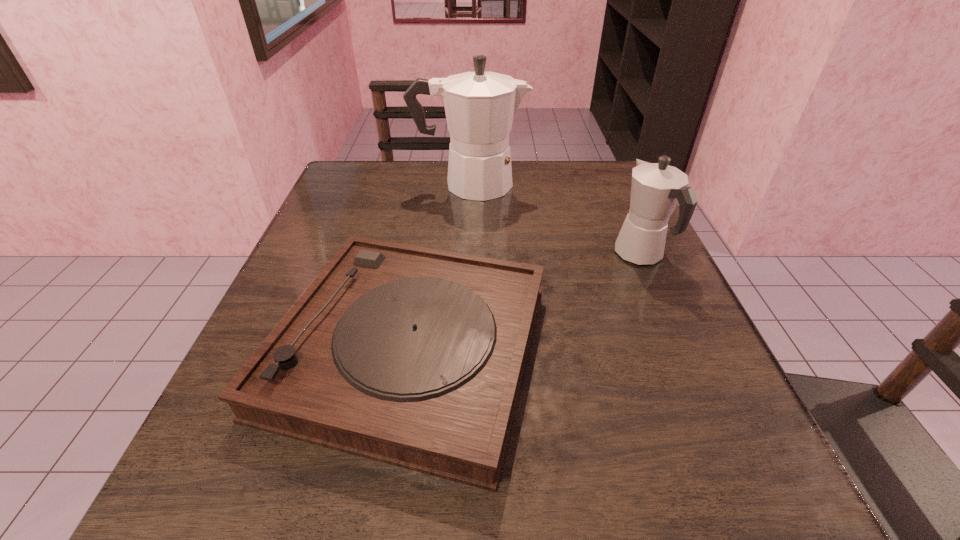
I want to click on object that is at the left edge, so click(411, 356).

I want to click on object positioned at the right edge, so click(656, 189).

The width and height of the screenshot is (960, 540). Identify the location of object that is at the near left corner. (411, 356).

Where is `vacant region at the near edge`? vacant region at the near edge is located at coordinates (612, 521).

You are a GUI agent. You are given a task and a screenshot of the screen. Output one action in this format:
    pyautogui.click(x=<x>, y=<y>)
    Task: Click on the vacant space at the left edge of the desktop
    Image resolution: width=960 pixels, height=540 pixels.
    Given the screenshot: What is the action you would take?
    pyautogui.click(x=350, y=218)

This screenshot has height=540, width=960. I want to click on vacant region at the right edge, so click(675, 382).

Where is `vacant region at the far left corner of the desktop`? vacant region at the far left corner of the desktop is located at coordinates (357, 171).

In the image, there is a desktop. At what (x,y) coordinates should I click in order to perform the action: click on vacant space at the near left corner. Please return your answer as a coordinate pair (x, y). Looking at the image, I should click on (270, 518).

You are a GUI agent. You are given a task and a screenshot of the screen. Output one action in this format:
    pyautogui.click(x=<x>, y=<y>)
    Task: Click on the vacant area at the far right corner
    
    Given the screenshot: What is the action you would take?
    pyautogui.click(x=598, y=160)

In order to click on object that ranks as the closest to the nearer coffeepot in this screenshot , I will do `click(411, 356)`.